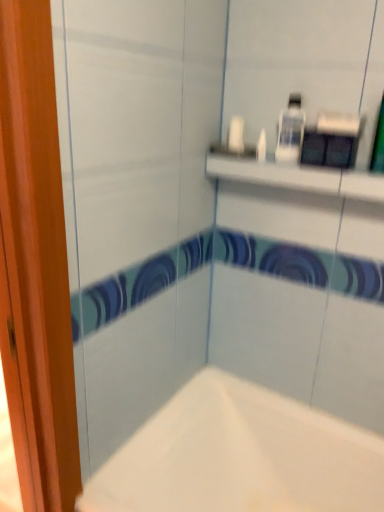
Question: From a real-world perspective, is white matte bathtub at lower center physically located above or below white glossy bottle at upper center?

Choices:
 (A) above
 (B) below

Answer: (B)

Question: Considering their positions, is white matte bathtub at lower center located in front of or behind white glossy bottle at upper center?

Choices:
 (A) front
 (B) behind

Answer: (A)

Question: Is white matte bathtub at lower center inside the boundaries of white glossy bottle at upper center, or outside?

Choices:
 (A) inside
 (B) outside

Answer: (B)

Question: Does point (296, 125) appear closer or farther from the camera than point (273, 430)?

Choices:
 (A) closer
 (B) farther

Answer: (A)

Question: Based on their sizes in the image, would you say white glossy bottle at upper center is bigger or smaller than white matte bathtub at lower center?

Choices:
 (A) big
 (B) small

Answer: (B)

Question: Considering their positions, is white glossy bottle at upper center located in front of or behind white matte bathtub at lower center?

Choices:
 (A) behind
 (B) front

Answer: (A)

Question: Is white glossy bottle at upper center inside or outside of white matte bathtub at lower center?

Choices:
 (A) inside
 (B) outside

Answer: (B)